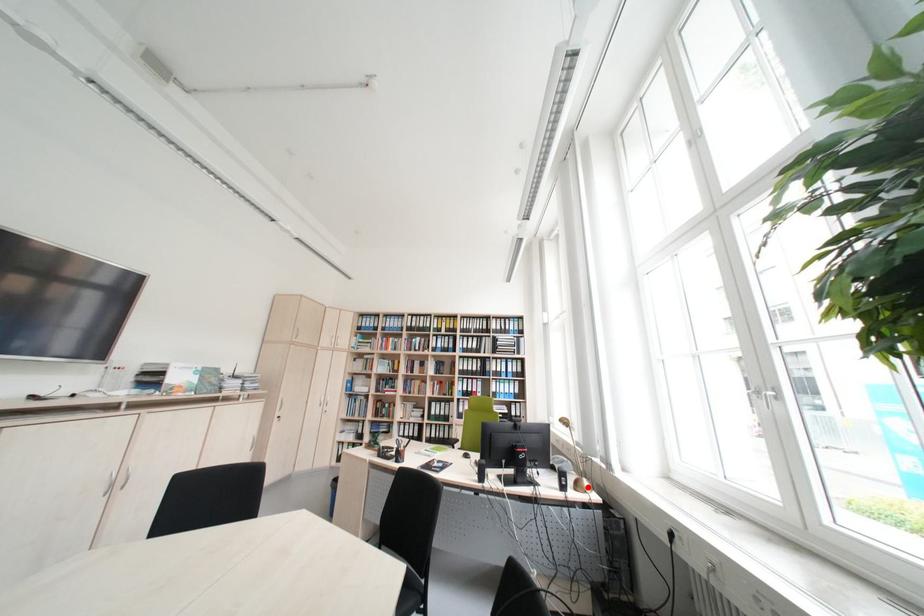
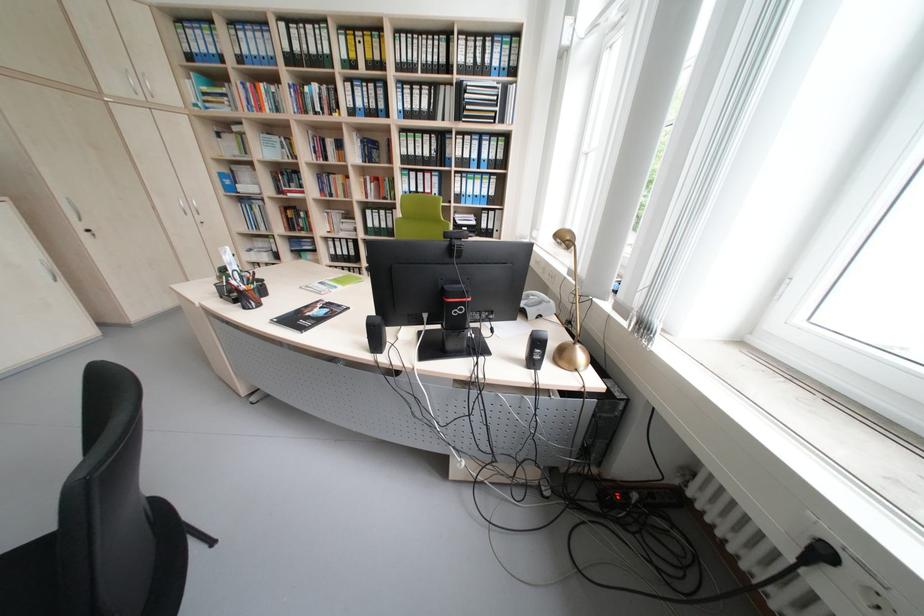
Locate, in the second image, the point that corresponds to the highlighted location in the first image.

(573, 358)